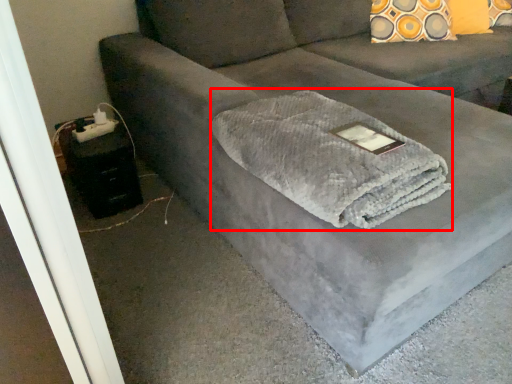
Question: In this image, where is bath towel (annotated by the red box) located relative to table?

Choices:
 (A) left
 (B) right

Answer: (B)